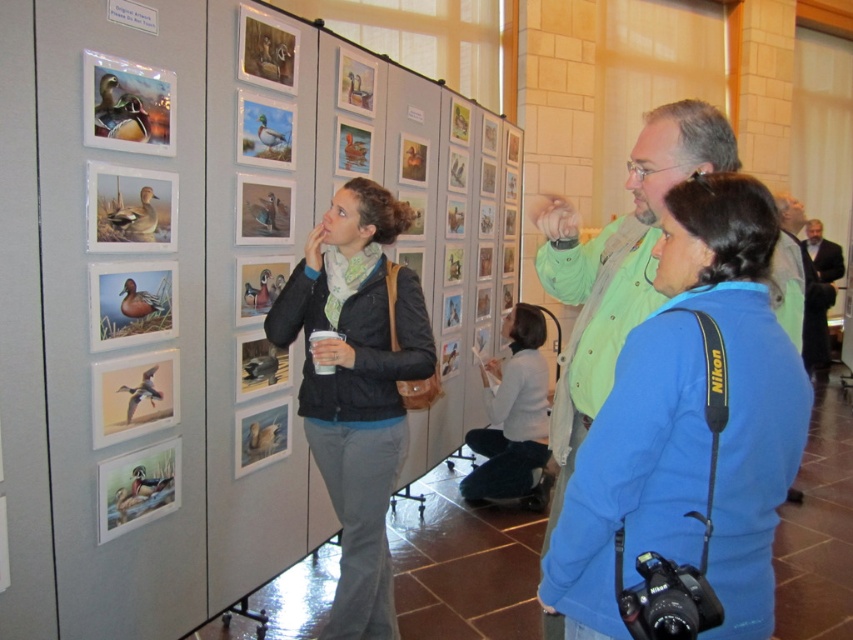
You are an art gallery assistant who needs to place a new painting between the black matte jacket at center and the dark suit at right. The painting is 1.2 meters wide. Can you fit it between them without moving either object?

The black matte jacket at center has a lesser width compared to dark suit at right. The total width between them would depend on their separation distance, but since the question only provides relative sizes, we cannot determine if the 1.2m painting fits without knowing the actual distance between the two objects.

Based on the photo, you are standing at the point with coordinates (689, 424) in the image. What object are you touching?

The point at (689, 424) is on the blue fabric jacket at center, so you are touching the blue fabric jacket at center.